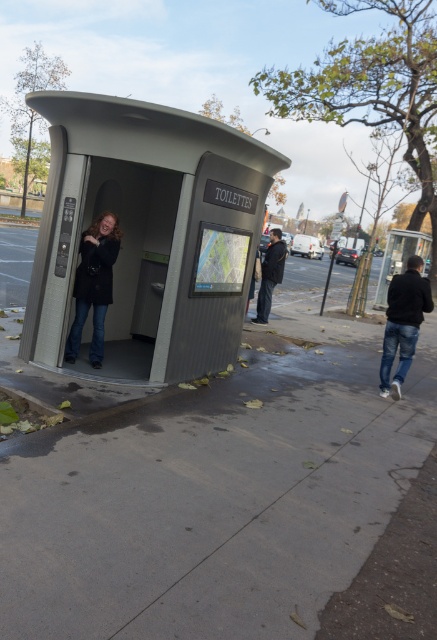
Question: Among these points, which one is farthest from the camera?

Choices:
 (A) (243, 195)
 (B) (402, 284)

Answer: (B)

Question: Which point is closer to the camera taking this photo?

Choices:
 (A) (6, 515)
 (B) (267, 312)
 (C) (97, 353)

Answer: (A)

Question: Which point is closer to the camera?

Choices:
 (A) (392, 308)
 (B) (141, 244)
 (C) (277, 243)
 (D) (56, 516)

Answer: (D)

Question: Is gray concrete sidewalk at lower center to the right of metallic gray bus stop at center from the viewer's perspective?

Choices:
 (A) no
 (B) yes

Answer: (A)

Question: Is gray concrete sidewalk at lower center positioned behind black matte jacket at lower right?

Choices:
 (A) no
 (B) yes

Answer: (A)

Question: In this image, where is metallic gray bus stop at center located relative to dark blue jeans at center?

Choices:
 (A) below
 (B) above

Answer: (A)